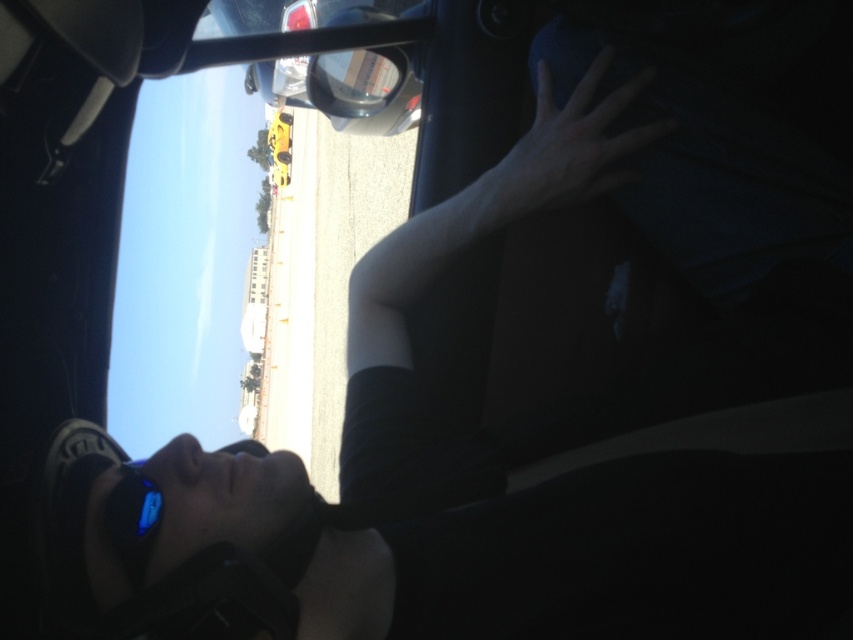
You are a passenger in the car and want to know if your hand can fit between the skinny white hand at upper center and the sunglasses at lower left. Can it?

The skinny white hand at upper center is wider than the sunglasses at lower left, so there might not be enough space for your hand to fit between them.

You are sitting in the driver seat of a car and see the skinny white hand at upper center on the dashboard. If you want to reach it without moving your seat, can you do it?

The skinny white hand at upper center is 8.28 feet away from you, which is too far to reach without moving your seat. You would need to adjust your seat forward to get closer.

You are a passenger in the car and want to know if the skinny white hand at upper center is taller than the sunglasses at lower left. Based on the scene, can you tell?

The skinny white hand at upper center has a greater height compared to the sunglasses at lower left, so yes, the skinny white hand at upper center is taller than the sunglasses at lower left.